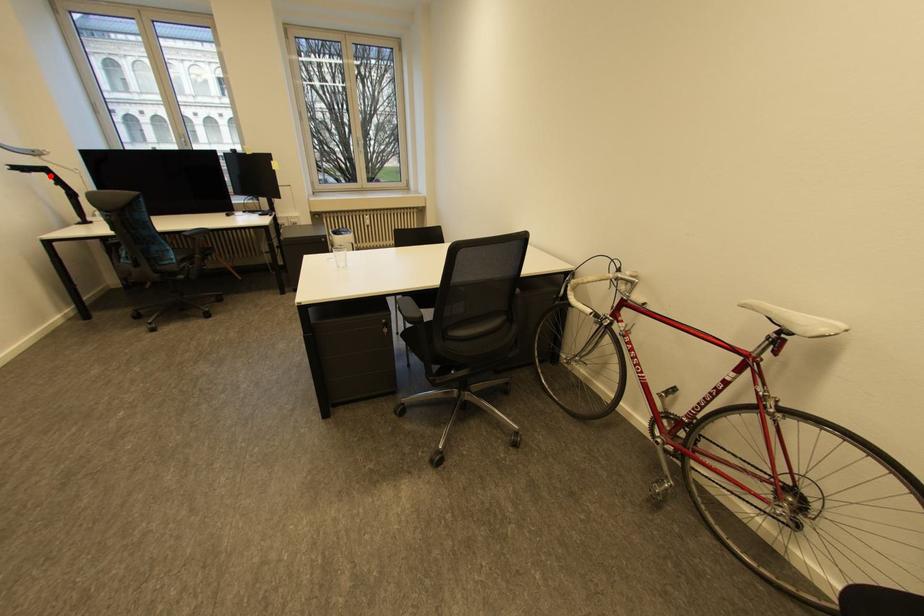
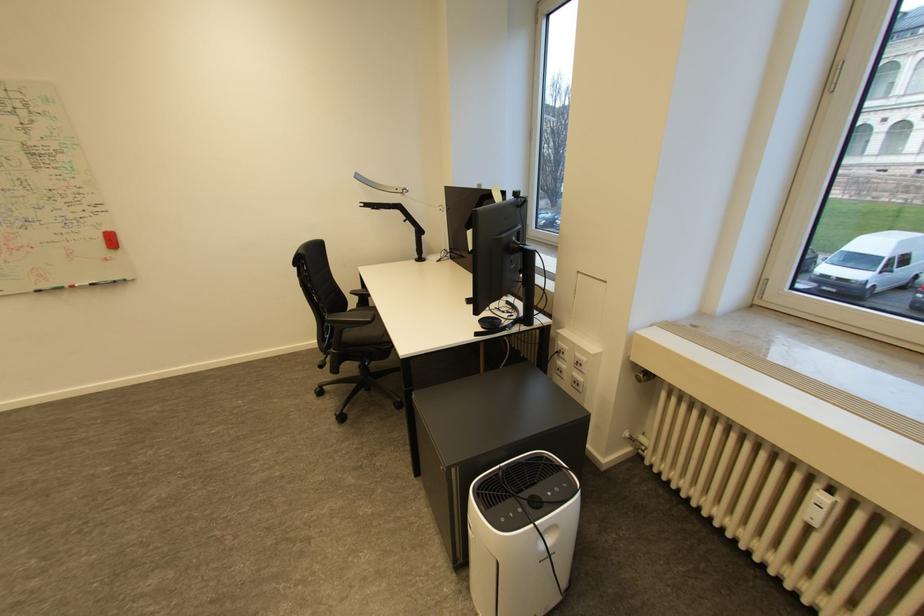
Find the pixel in the second image that matches the highlighted location in the first image.

(405, 213)